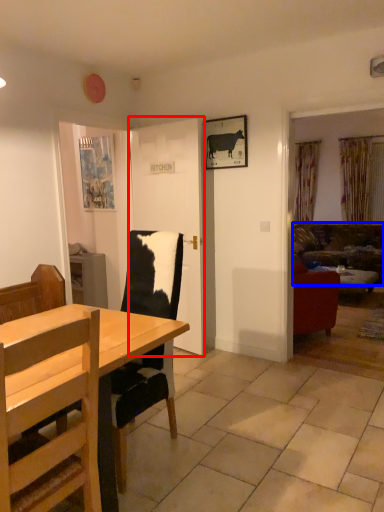
Question: Among these objects, which one is farthest to the camera, door (highlighted by a red box) or studio couch (highlighted by a blue box)?

Choices:
 (A) door
 (B) studio couch

Answer: (B)